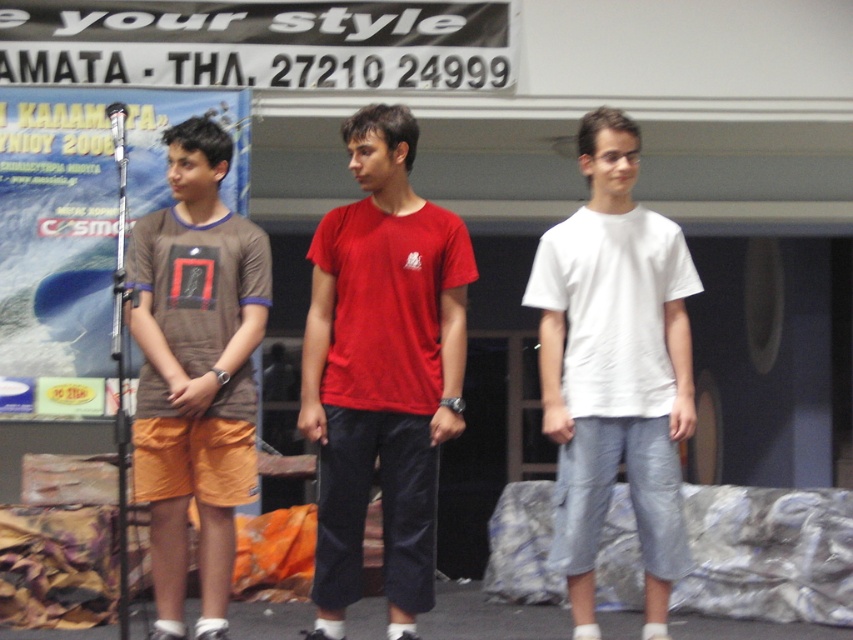
Question: Among these objects, which one is nearest to the camera?

Choices:
 (A) matte red t-shirt at center
 (B) white cotton t-shirt at center
 (C) metallic silver microphone at upper left
 (D) white matte t-shirt at center

Answer: (A)

Question: Which point is closer to the camera?

Choices:
 (A) (154, 586)
 (B) (664, 259)

Answer: (B)

Question: Does matte brown t-shirt at center appear on the left side of white matte t-shirt at center?

Choices:
 (A) yes
 (B) no

Answer: (A)

Question: Does white cotton t-shirt at center have a greater width compared to metallic silver microphone at upper left?

Choices:
 (A) no
 (B) yes

Answer: (B)

Question: Estimate the real-world distances between objects in this image. Which object is closer to the matte brown t-shirt at center?

Choices:
 (A) metallic silver microphone at upper left
 (B) white cotton t-shirt at center

Answer: (A)

Question: Does matte brown t-shirt at center lie behind metallic silver microphone at upper left?

Choices:
 (A) yes
 (B) no

Answer: (B)